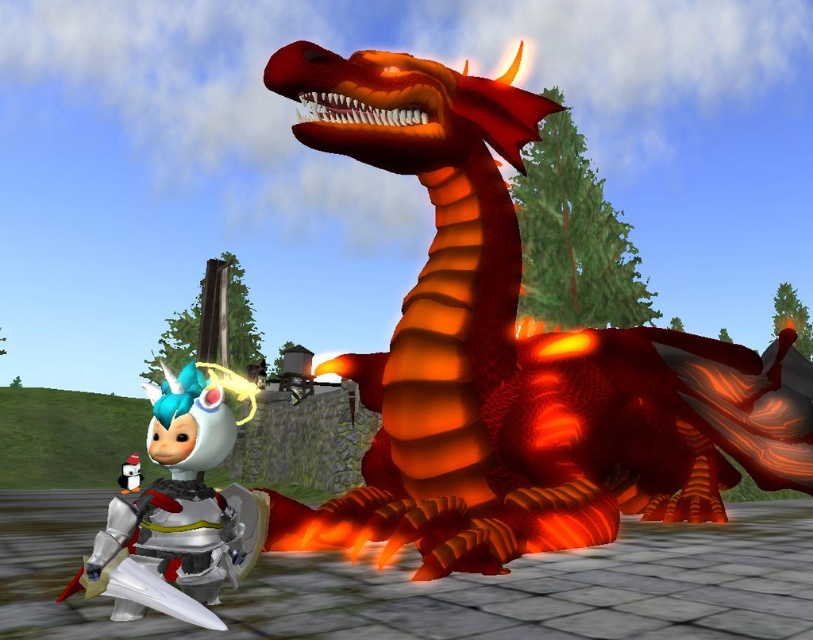
Question: Is shiny orange dragon at center wider than metallic silver armor at left?

Choices:
 (A) yes
 (B) no

Answer: (A)

Question: Which of the following is the closest to the observer?

Choices:
 (A) metallic silver armor at left
 (B) shiny orange dragon at center

Answer: (A)

Question: Is shiny orange dragon at center positioned before metallic silver armor at left?

Choices:
 (A) no
 (B) yes

Answer: (A)

Question: Does shiny orange dragon at center appear on the right side of metallic silver armor at left?

Choices:
 (A) no
 (B) yes

Answer: (B)